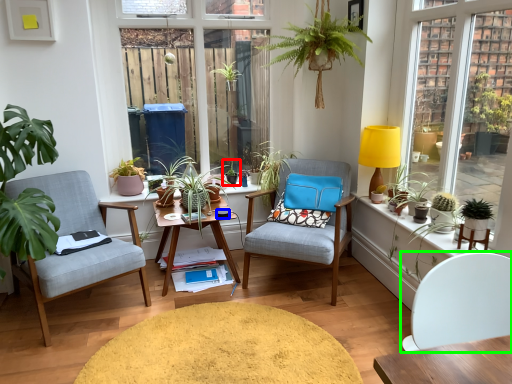
Question: Which is nearer to the houseplant (highlighted by a red box)? coffee cup (highlighted by a blue box) or chair (highlighted by a green box).

Choices:
 (A) coffee cup
 (B) chair

Answer: (A)